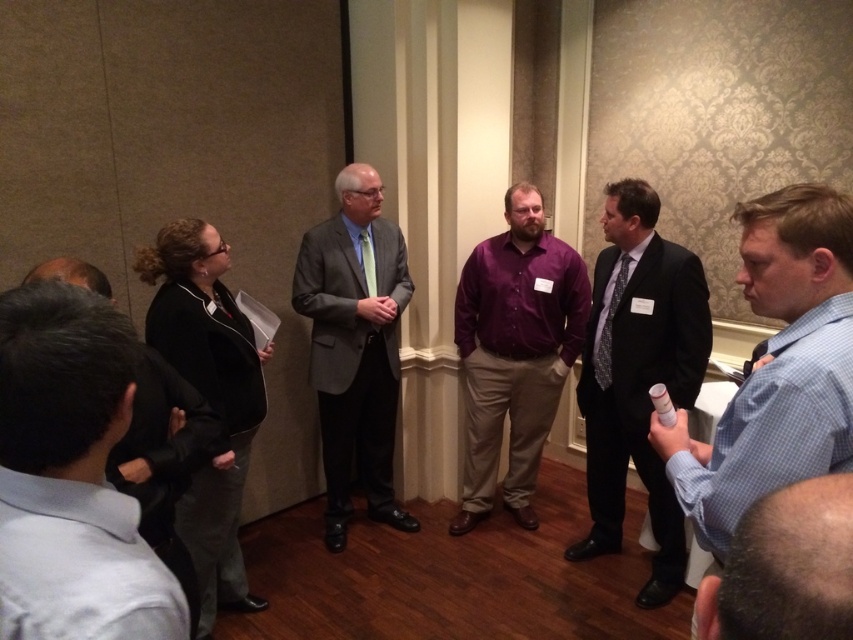
Question: Can you confirm if matte black suit at center is positioned to the left of purple cotton shirt at center?

Choices:
 (A) yes
 (B) no

Answer: (B)

Question: Which is farther from the light blue checkered shirt at lower right?

Choices:
 (A) purple cotton shirt at center
 (B) matte black suit at center

Answer: (A)

Question: Does matte black suit at center have a larger size compared to light blue checkered shirt at lower right?

Choices:
 (A) yes
 (B) no

Answer: (A)

Question: Among these points, which one is farthest from the camera?

Choices:
 (A) (328, 248)
 (B) (758, 636)

Answer: (A)

Question: Is purple cotton shirt at center bigger than light blue checkered shirt at lower right?

Choices:
 (A) no
 (B) yes

Answer: (B)

Question: Which is nearer to the light blue checkered shirt at lower right?

Choices:
 (A) light blue shirt at lower left
 (B) purple cotton shirt at center
 (C) matte black suit at center

Answer: (A)